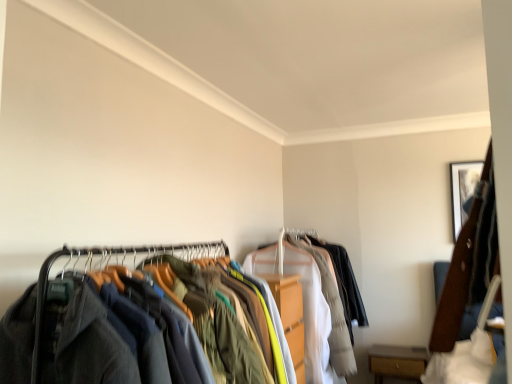
At what (x,y) coordinates should I click in order to perform the action: click on dark gray fabric clothes at left. Please return your answer as a coordinate pair (x, y). This screenshot has width=512, height=384. Looking at the image, I should click on [x=110, y=321].

The height and width of the screenshot is (384, 512). What are the coordinates of `brown wood drawer at lower right` in the screenshot? It's located at (397, 362).

From a real-world perspective, between dark gray fabric clothes at left and brown wood drawer at lower right, who is vertically lower?

brown wood drawer at lower right is physically lower.

Looking at their sizes, would you say dark gray fabric clothes at left is wider or thinner than brown wood drawer at lower right?

dark gray fabric clothes at left is wider than brown wood drawer at lower right.

Is there a large distance between dark gray fabric clothes at left and brown wood drawer at lower right?

Absolutely, dark gray fabric clothes at left is distant from brown wood drawer at lower right.

Where is `furniture below the dark gray fabric clothes at left (from a real-world perspective)`? This screenshot has width=512, height=384. furniture below the dark gray fabric clothes at left (from a real-world perspective) is located at coordinates (397, 362).

Does brown wood drawer at lower right have a smaller size compared to wooden framed picture at upper right?

No, brown wood drawer at lower right is not smaller than wooden framed picture at upper right.

Is brown wood drawer at lower right far away from wooden framed picture at upper right?

Indeed, brown wood drawer at lower right is not near wooden framed picture at upper right.

What's the angular difference between brown wood drawer at lower right and wooden framed picture at upper right's facing directions?

They differ by 1.01 degrees in their facing directions.

This screenshot has width=512, height=384. In the image, there is a dark gray fabric clothes at left. Find the location of `garment below it (from the image's perspective)`. garment below it (from the image's perspective) is located at coordinates (312, 305).

Is light gray cotton shirt at center turned away from dark gray fabric clothes at left?

No.

Considering the relative sizes of light gray cotton shirt at center and dark gray fabric clothes at left in the image provided, is light gray cotton shirt at center thinner than dark gray fabric clothes at left?

No, light gray cotton shirt at center is not thinner than dark gray fabric clothes at left.

In the image, is light gray cotton shirt at center positioned in front of or behind dark gray fabric clothes at left?

light gray cotton shirt at center is positioned farther from the viewer than dark gray fabric clothes at left.

Between brown wood drawer at lower right and dark gray fabric clothes at left, which one has larger size?

dark gray fabric clothes at left.

Based on the photo, is brown wood drawer at lower right with dark gray fabric clothes at left?

No, brown wood drawer at lower right is not touching dark gray fabric clothes at left.

Identify the location of furniture that appears below the dark gray fabric clothes at left (from a real-world perspective). The width and height of the screenshot is (512, 384). (397, 362).

Considering the relative sizes of brown wood drawer at lower right and dark gray fabric clothes at left in the image provided, is brown wood drawer at lower right shorter than dark gray fabric clothes at left?

Indeed, brown wood drawer at lower right has a lesser height compared to dark gray fabric clothes at left.

Which object is further away from the camera taking this photo, wooden framed picture at upper right or dark gray fabric clothes at left?

wooden framed picture at upper right is behind.

In terms of height, does wooden framed picture at upper right look taller or shorter compared to dark gray fabric clothes at left?

In the image, wooden framed picture at upper right appears to be shorter than dark gray fabric clothes at left.

Can you confirm if wooden framed picture at upper right is thinner than dark gray fabric clothes at left?

Correct, the width of wooden framed picture at upper right is less than that of dark gray fabric clothes at left.

From a real-world perspective, is wooden framed picture at upper right beneath dark gray fabric clothes at left?

No, from a real-world perspective, wooden framed picture at upper right is not under dark gray fabric clothes at left.

Considering the relative sizes of dark gray fabric clothes at left and wooden framed picture at upper right in the image provided, is dark gray fabric clothes at left thinner than wooden framed picture at upper right?

No, dark gray fabric clothes at left is not thinner than wooden framed picture at upper right.

Is dark gray fabric clothes at left spatially inside wooden framed picture at upper right, or outside of it?

dark gray fabric clothes at left lies outside wooden framed picture at upper right.

Can you confirm if dark gray fabric clothes at left is bigger than wooden framed picture at upper right?

Correct, dark gray fabric clothes at left is larger in size than wooden framed picture at upper right.

Based on the photo, relative to brown wood drawer at lower right, is wooden framed picture at upper right in front or behind?

In the image, wooden framed picture at upper right appears behind brown wood drawer at lower right.

Is wooden framed picture at upper right to the right of brown wood drawer at lower right from the viewer's perspective?

Yes.

In the scene shown: From the image's perspective, is wooden framed picture at upper right located beneath brown wood drawer at lower right?

Actually, wooden framed picture at upper right appears above brown wood drawer at lower right in the image.

Which is in front, point (452, 180) or point (389, 371)?

Positioned in front is point (389, 371).

Locate an element on the screen. This screenshot has width=512, height=384. closet above the brown wood drawer at lower right (from a real-world perspective) is located at coordinates (110, 321).

Locate an element on the screen. This screenshot has height=384, width=512. furniture on the left side of wooden framed picture at upper right is located at coordinates (397, 362).

When comparing their distances from light gray cotton shirt at center, does wooden framed picture at upper right or brown wood drawer at lower right seem closer?

Based on the image, brown wood drawer at lower right appears to be nearer to light gray cotton shirt at center.

Estimate the real-world distances between objects in this image. Which object is further from wooden framed picture at upper right, dark gray fabric clothes at left or light gray cotton shirt at center?

dark gray fabric clothes at left lies further to wooden framed picture at upper right than the other object.

Based on the photo, from the image, which object appears to be nearer to dark gray fabric clothes at left, light gray cotton shirt at center or brown wood drawer at lower right?

light gray cotton shirt at center.

When comparing their distances from dark gray fabric clothes at left, does brown wood drawer at lower right or wooden framed picture at upper right seem closer?

brown wood drawer at lower right is positioned closer to the anchor dark gray fabric clothes at left.

Considering their positions, is light gray cotton shirt at center positioned further to brown wood drawer at lower right than dark gray fabric clothes at left?

Among the two, dark gray fabric clothes at left is located further to brown wood drawer at lower right.

Looking at the image, which one is located closer to brown wood drawer at lower right, light gray cotton shirt at center or wooden framed picture at upper right?

The object closer to brown wood drawer at lower right is light gray cotton shirt at center.

Based on their spatial positions, is wooden framed picture at upper right or brown wood drawer at lower right further from dark gray fabric clothes at left?

Among the two, wooden framed picture at upper right is located further to dark gray fabric clothes at left.

Estimate the real-world distances between objects in this image. Which object is further from wooden framed picture at upper right, brown wood drawer at lower right or light gray cotton shirt at center?

The object further to wooden framed picture at upper right is light gray cotton shirt at center.

Where is `furniture between dark gray fabric clothes at left and wooden framed picture at upper right in the front-back direction`? Image resolution: width=512 pixels, height=384 pixels. furniture between dark gray fabric clothes at left and wooden framed picture at upper right in the front-back direction is located at coordinates (397, 362).

Locate an element on the screen. garment between dark gray fabric clothes at left and wooden framed picture at upper right in the front-back direction is located at coordinates (312, 305).

Where is `garment between dark gray fabric clothes at left and brown wood drawer at lower right from front to back`? This screenshot has width=512, height=384. garment between dark gray fabric clothes at left and brown wood drawer at lower right from front to back is located at coordinates (312, 305).

Where is `furniture situated between light gray cotton shirt at center and wooden framed picture at upper right from left to right`? furniture situated between light gray cotton shirt at center and wooden framed picture at upper right from left to right is located at coordinates (397, 362).